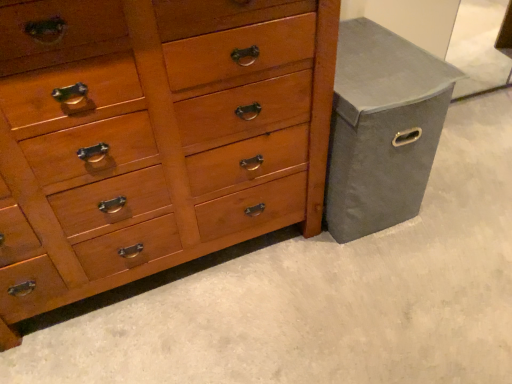
What is the approximate width of matte gray fabric bin at right?

matte gray fabric bin at right is 24.11 inches wide.

What do you see at coordinates (382, 129) in the screenshot?
I see `matte gray fabric bin at right` at bounding box center [382, 129].

Locate an element on the screen. This screenshot has height=384, width=512. matte gray fabric bin at right is located at coordinates (382, 129).

What is the approximate height of shiny wood chest of drawers at center?

The height of shiny wood chest of drawers at center is 95.66 centimeters.

Locate an element on the screen. shiny wood chest of drawers at center is located at coordinates (153, 137).

This screenshot has height=384, width=512. Describe the element at coordinates (153, 137) in the screenshot. I see `shiny wood chest of drawers at center` at that location.

Where is `matte gray fabric bin at right`? matte gray fabric bin at right is located at coordinates [x=382, y=129].

Does matte gray fabric bin at right appear on the left side of shiny wood chest of drawers at center?

Incorrect, matte gray fabric bin at right is not on the left side of shiny wood chest of drawers at center.

Which object is closer to the camera taking this photo, matte gray fabric bin at right or shiny wood chest of drawers at center?

shiny wood chest of drawers at center is more forward.

Does point (404, 99) lie behind point (158, 222)?

That is False.

From the image's perspective, which one is positioned higher, matte gray fabric bin at right or shiny wood chest of drawers at center?

From the image's view, matte gray fabric bin at right is above.

From a real-world perspective, relative to shiny wood chest of drawers at center, is matte gray fabric bin at right vertically above or below?

Clearly, from a real-world perspective, matte gray fabric bin at right is below shiny wood chest of drawers at center.

Is matte gray fabric bin at right wider or thinner than shiny wood chest of drawers at center?

matte gray fabric bin at right is wider than shiny wood chest of drawers at center.

Is matte gray fabric bin at right taller or shorter than shiny wood chest of drawers at center?

Considering their sizes, matte gray fabric bin at right has less height than shiny wood chest of drawers at center.

Consider the image. Can you confirm if matte gray fabric bin at right is bigger than shiny wood chest of drawers at center?

Incorrect, matte gray fabric bin at right is not larger than shiny wood chest of drawers at center.

Is matte gray fabric bin at right outside of shiny wood chest of drawers at center?

That's correct, matte gray fabric bin at right is outside of shiny wood chest of drawers at center.

Is matte gray fabric bin at right positioned far away from shiny wood chest of drawers at center?

They are positioned close to each other.

Is matte gray fabric bin at right oriented towards shiny wood chest of drawers at center?

No, matte gray fabric bin at right is not oriented towards shiny wood chest of drawers at center.

From the picture: Can you tell me how much matte gray fabric bin at right and shiny wood chest of drawers at center differ in facing direction?

They differ by 0.227 degrees in their facing directions.

Image resolution: width=512 pixels, height=384 pixels. Identify the location of gray below the shiny wood chest of drawers at center (from a real-world perspective). (382, 129).

Considering the relative positions of shiny wood chest of drawers at center and matte gray fabric bin at right in the image provided, is shiny wood chest of drawers at center to the left of matte gray fabric bin at right from the viewer's perspective?

Yes.

In the image, is shiny wood chest of drawers at center positioned in front of or behind matte gray fabric bin at right?

Clearly, shiny wood chest of drawers at center is in front of matte gray fabric bin at right.

Does point (214, 171) come behind point (365, 45)?

No, it is not.

From the image's perspective, who appears lower, shiny wood chest of drawers at center or matte gray fabric bin at right?

shiny wood chest of drawers at center.

From a real-world perspective, between shiny wood chest of drawers at center and matte gray fabric bin at right, who is vertically higher?

shiny wood chest of drawers at center, from a real-world perspective.

Which object is wider, shiny wood chest of drawers at center or matte gray fabric bin at right?

matte gray fabric bin at right is wider.

Can you confirm if shiny wood chest of drawers at center is shorter than matte gray fabric bin at right?

No.

Considering the relative sizes of shiny wood chest of drawers at center and matte gray fabric bin at right in the image provided, is shiny wood chest of drawers at center bigger than matte gray fabric bin at right?

Indeed, shiny wood chest of drawers at center has a larger size compared to matte gray fabric bin at right.

Is matte gray fabric bin at right inside shiny wood chest of drawers at center?

No, matte gray fabric bin at right is located outside of shiny wood chest of drawers at center.

Is shiny wood chest of drawers at center placed right next to matte gray fabric bin at right?

No.

Is shiny wood chest of drawers at center aimed at matte gray fabric bin at right?

No, shiny wood chest of drawers at center is not aimed at matte gray fabric bin at right.

The width and height of the screenshot is (512, 384). In order to click on chest of drawers below the matte gray fabric bin at right (from the image's perspective) in this screenshot , I will do `click(153, 137)`.

Where is `chest of drawers in front of the matte gray fabric bin at right`? chest of drawers in front of the matte gray fabric bin at right is located at coordinates (153, 137).

This screenshot has width=512, height=384. I want to click on chest of drawers on the left of the matte gray fabric bin at right, so click(x=153, y=137).